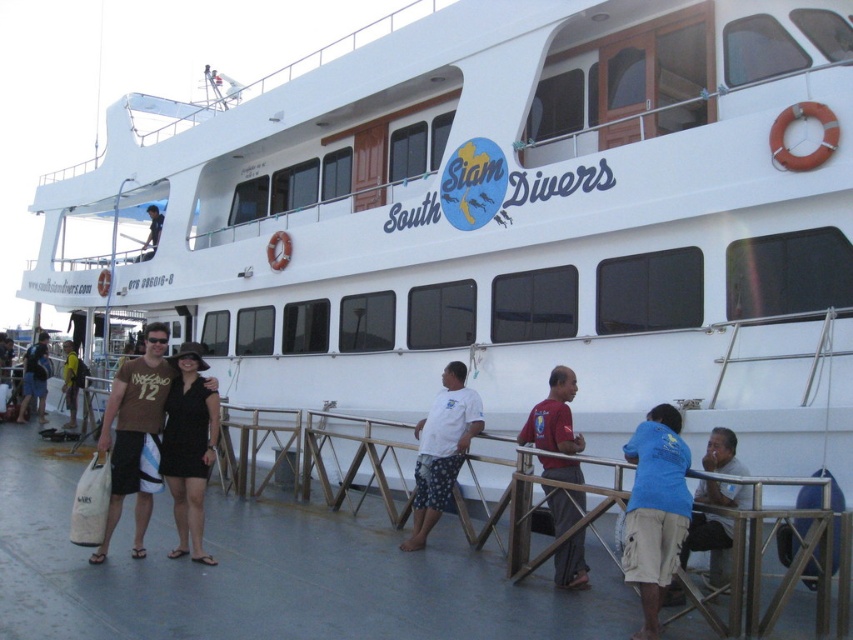
Can you confirm if blue cotton shirt at lower right is positioned to the left of matte black dress at center?

Incorrect, blue cotton shirt at lower right is not on the left side of matte black dress at center.

Which is below, blue cotton shirt at lower right or matte black dress at center?

blue cotton shirt at lower right

Is point (639, 460) positioned in front of point (119, 420)?

That is True.

In order to click on blue cotton shirt at lower right in this screenshot , I will do `click(654, 509)`.

Between point (102, 556) and point (428, 502), which one is positioned behind?

Point (428, 502)

Does matte black dress at center have a larger size compared to white cotton shirt at center?

No, matte black dress at center is not bigger than white cotton shirt at center.

Between point (160, 429) and point (442, 422), which one is positioned behind?

The point (442, 422) is more distant.

Locate an element on the screen. The image size is (853, 640). matte black dress at center is located at coordinates (134, 433).

Between point (570, 518) and point (74, 404), which one is positioned behind?

The point (74, 404) is behind.

Consider the image. Who is more forward, [556,577] or [77,372]?

Point [556,577] is in front.

Does point (587, 572) lie in front of point (74, 381)?

Yes.

The width and height of the screenshot is (853, 640). In order to click on red fabric shirt at center in this screenshot , I will do `click(553, 417)`.